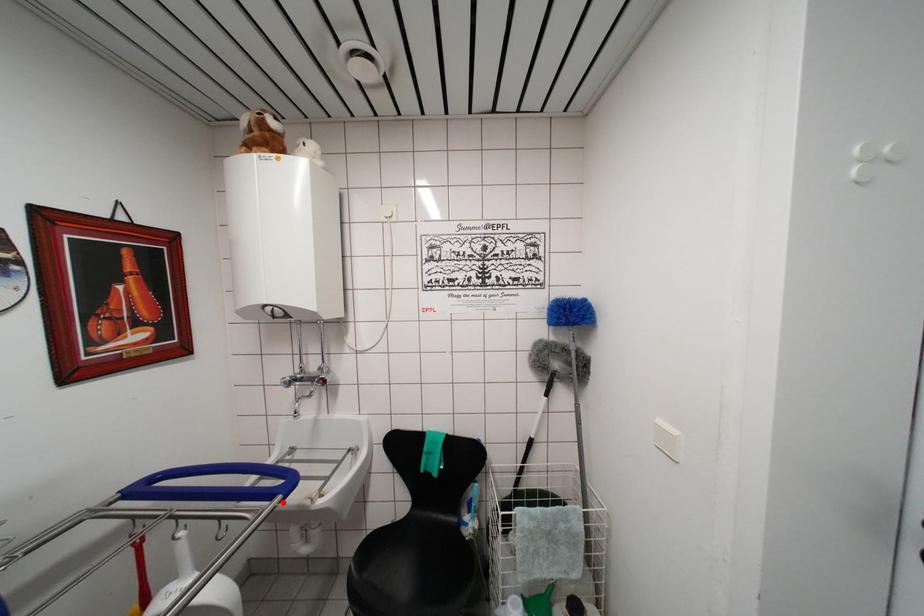
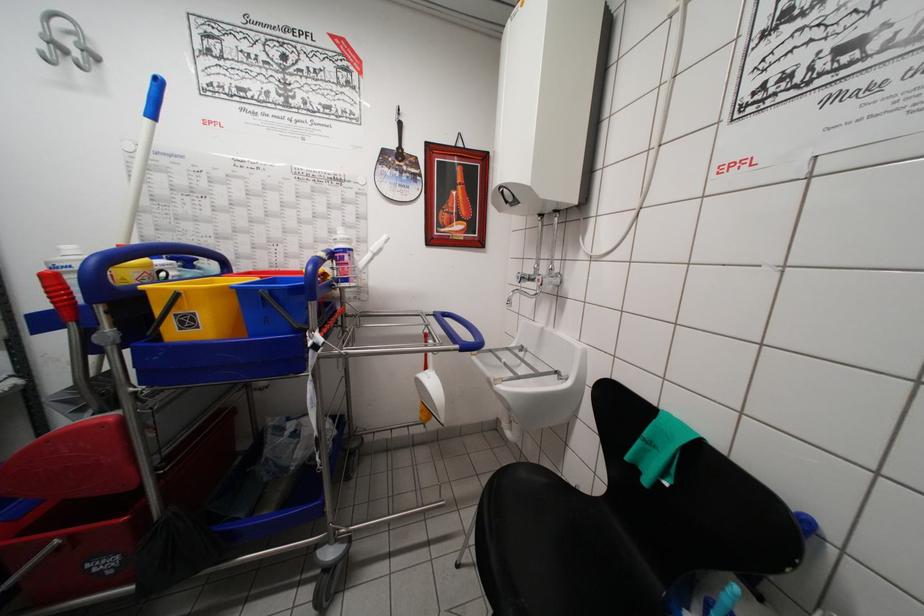
Find the pixel in the second image that matches the highlighted location in the first image.

(460, 351)